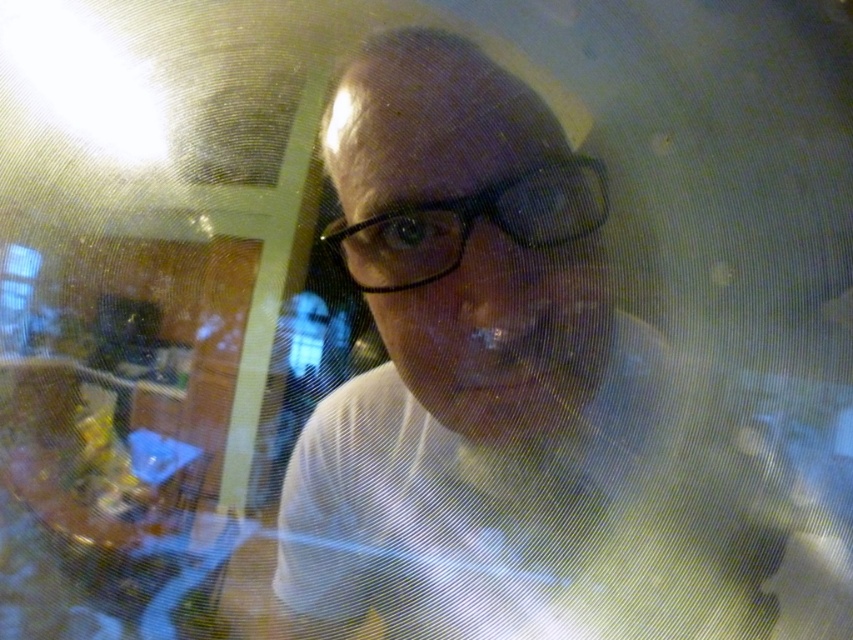
You are a photographer trying to focus on the subject in the image. Since the white matte shirt at center and the black plastic glasses at center are both in the center, which one is closer to the camera?

The white matte shirt at center is located below the black plastic glasses at center, so the black plastic glasses at center is closer to the camera.

From the picture: You are standing in the room shown in the image and want to reach the point marked at coordinates (436, 588). If your arm is 36 inches long, can you touch that point without moving your feet?

The point at coordinates (436, 588) is 37.78 inches away from you, which is slightly farther than your 36 inch arm length. So you cannot touch it without moving your feet.

You are a photographer trying to capture a clear portrait of the person in the image. You notice the white matte shirt at center and the black plastic glasses at center. Considering their sizes in the frame, which object would appear larger in the final photo?

The white matte shirt at center would appear larger in the final photo because it has a greater height compared to the black plastic glasses at center.